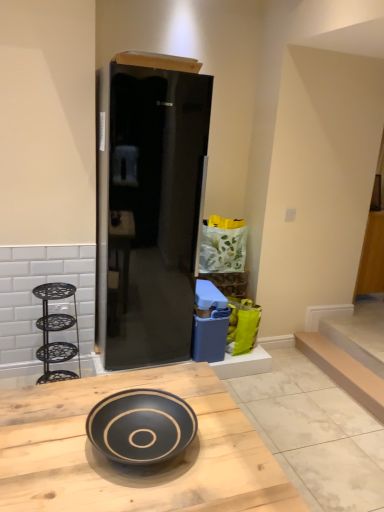
Question: Considering the relative positions of black glass refrigerator at center and black matte bowl at center in the image provided, is black glass refrigerator at center to the left of black matte bowl at center from the viewer's perspective?

Choices:
 (A) yes
 (B) no

Answer: (A)

Question: Does black glass refrigerator at center have a smaller size compared to black matte bowl at center?

Choices:
 (A) no
 (B) yes

Answer: (A)

Question: Are black glass refrigerator at center and black matte bowl at center far apart?

Choices:
 (A) yes
 (B) no

Answer: (A)

Question: Is black glass refrigerator at center next to black matte bowl at center and touching it?

Choices:
 (A) yes
 (B) no

Answer: (B)

Question: Does black glass refrigerator at center have a lesser width compared to black matte bowl at center?

Choices:
 (A) yes
 (B) no

Answer: (A)

Question: Choose the correct answer: Is black glossy bowl at center inside black matte bowl at center or outside it?

Choices:
 (A) outside
 (B) inside

Answer: (A)

Question: In the image, is black glossy bowl at center positioned in front of or behind black matte bowl at center?

Choices:
 (A) behind
 (B) front

Answer: (B)

Question: Considering the positions of point (99, 428) and point (29, 476), is point (99, 428) closer or farther from the camera than point (29, 476)?

Choices:
 (A) farther
 (B) closer

Answer: (A)

Question: Looking at the image, does black glossy bowl at center seem bigger or smaller compared to black matte bowl at center?

Choices:
 (A) big
 (B) small

Answer: (B)

Question: Does point (304, 346) appear closer or farther from the camera than point (56, 356)?

Choices:
 (A) closer
 (B) farther

Answer: (B)

Question: Is smooth beige stair at lower right inside the boundaries of black wrought iron shelving unit at left, or outside?

Choices:
 (A) outside
 (B) inside

Answer: (A)

Question: Looking at the image, does smooth beige stair at lower right seem bigger or smaller compared to black wrought iron shelving unit at left?

Choices:
 (A) small
 (B) big

Answer: (A)

Question: Based on their positions, is smooth beige stair at lower right located to the left or right of black wrought iron shelving unit at left?

Choices:
 (A) left
 (B) right

Answer: (B)

Question: From a real-world perspective, relative to black matte bowl at center, is smooth beige stair at lower right vertically above or below?

Choices:
 (A) above
 (B) below

Answer: (A)

Question: Is smooth beige stair at lower right to the left or to the right of black matte bowl at center in the image?

Choices:
 (A) left
 (B) right

Answer: (B)